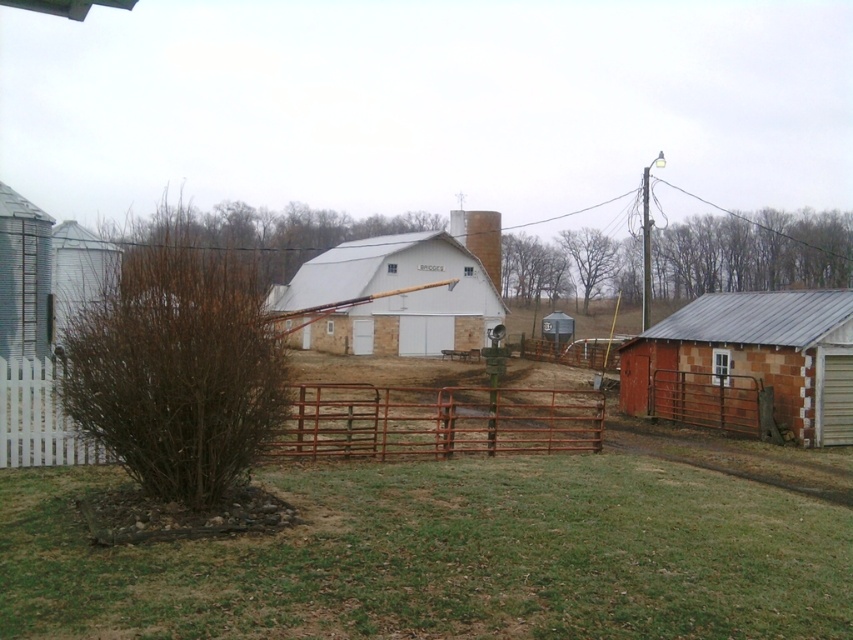
Question: Estimate the real-world distances between objects in this image. Which object is closer to the white matte barn at center?

Choices:
 (A) rusty metal gate at center
 (B) rustic brick shed at right
 (C) brushed metal silo at left

Answer: (A)

Question: Is rusty metal gate at center positioned before brown wood chimney at center?

Choices:
 (A) no
 (B) yes

Answer: (B)

Question: Which point is farther from the camera taking this photo?

Choices:
 (A) (700, 420)
 (B) (453, 218)
 (C) (107, 259)

Answer: (B)

Question: Which point is farther from the camera taking this photo?

Choices:
 (A) (454, 266)
 (B) (735, 392)

Answer: (A)

Question: Is rusty metal gate at center to the right of white matte barn at center from the viewer's perspective?

Choices:
 (A) yes
 (B) no

Answer: (A)

Question: Where is rusty metal gate at center located in relation to rustic brick shed at right in the image?

Choices:
 (A) right
 (B) left

Answer: (B)